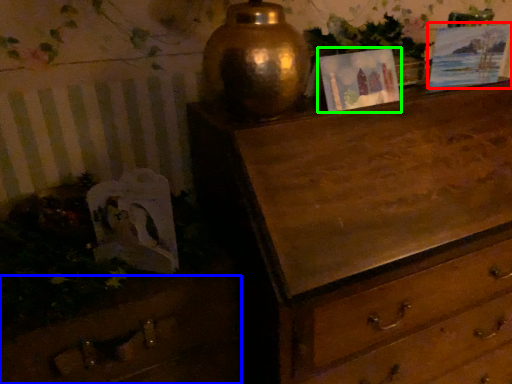
Question: Considering the real-world distances, which object is closest to picture frame (highlighted by a red box)? drawer (highlighted by a blue box) or picture frame (highlighted by a green box).

Choices:
 (A) drawer
 (B) picture frame

Answer: (B)